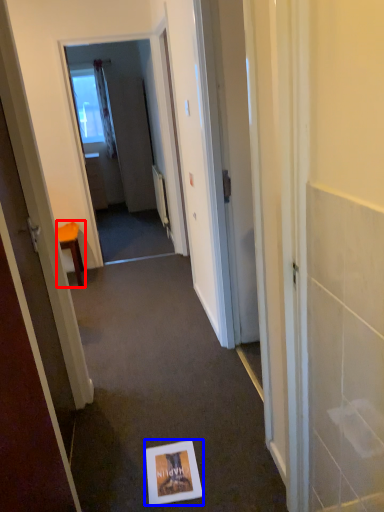
Question: Which point is further to the camera, furniture (highlighted by a red box) or postcard (highlighted by a blue box)?

Choices:
 (A) furniture
 (B) postcard

Answer: (A)